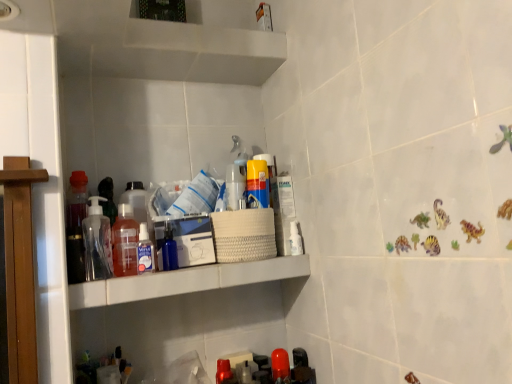
Question: Does transparent plastic spray bottle at upper center, the 1th toiletry when ordered from left to right, come in front of translucent plastic bottle at center, the 4th bottle in the left-to-right sequence?

Choices:
 (A) no
 (B) yes

Answer: (B)

Question: From the image's perspective, is transparent plastic spray bottle at upper center, the 1th toiletry positioned from the front, below translucent plastic bottle at center, the 4th bottle in the left-to-right sequence?

Choices:
 (A) no
 (B) yes

Answer: (B)

Question: Is transparent plastic spray bottle at upper center, the 1th toiletry when ordered from left to right, shorter than translucent plastic bottle at center, positioned as the first bottle in right-to-left order?

Choices:
 (A) yes
 (B) no

Answer: (A)

Question: Does transparent plastic spray bottle at upper center, positioned as the 3th toiletry in back-to-front order, appear on the left side of translucent plastic bottle at center, the 4th bottle in the left-to-right sequence?

Choices:
 (A) yes
 (B) no

Answer: (A)

Question: Is transparent plastic spray bottle at upper center, the 1th toiletry when ordered from left to right, not near translucent plastic bottle at center, positioned as the first bottle in right-to-left order?

Choices:
 (A) yes
 (B) no

Answer: (B)

Question: Can you confirm if transparent plastic spray bottle at upper center, acting as the 3th toiletry starting from the right, is wider than translucent plastic bottle at center, positioned as the first bottle in right-to-left order?

Choices:
 (A) yes
 (B) no

Answer: (B)

Question: Is white plastic bottle at upper right, which is the first toiletry from right to left, smaller than white plastic shelf at upper center?

Choices:
 (A) yes
 (B) no

Answer: (A)

Question: Does white plastic bottle at upper right, the first toiletry when ordered from back to front, appear on the right side of white plastic shelf at upper center?

Choices:
 (A) no
 (B) yes

Answer: (B)

Question: From the image's perspective, is white plastic bottle at upper right, the third toiletry from the left, below white plastic shelf at upper center?

Choices:
 (A) yes
 (B) no

Answer: (B)

Question: Could you tell me if white plastic bottle at upper right, which is the first toiletry from right to left, is turned towards white plastic shelf at upper center?

Choices:
 (A) no
 (B) yes

Answer: (A)

Question: Can we say white plastic bottle at upper right, which is the first toiletry from right to left, lies outside white plastic shelf at upper center?

Choices:
 (A) no
 (B) yes

Answer: (B)

Question: From a real-world perspective, is white plastic bottle at upper right, the first toiletry when ordered from back to front, physically above white plastic shelf at upper center?

Choices:
 (A) no
 (B) yes

Answer: (B)

Question: From a real-world perspective, is white plastic shelf at upper center positioned over transparent plastic spray bottle at upper center, the 1th toiletry when ordered from left to right, based on gravity?

Choices:
 (A) yes
 (B) no

Answer: (B)